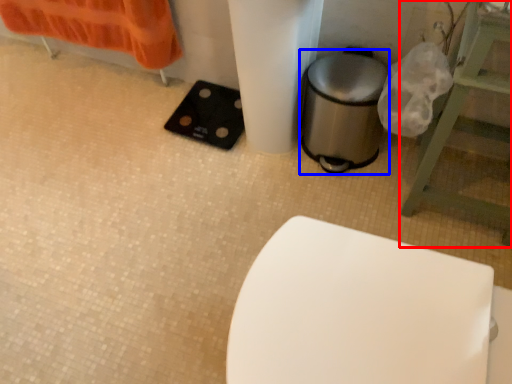
Question: Which of the following is the farthest to the observer, furniture (highlighted by a red box) or appliance (highlighted by a blue box)?

Choices:
 (A) furniture
 (B) appliance

Answer: (B)